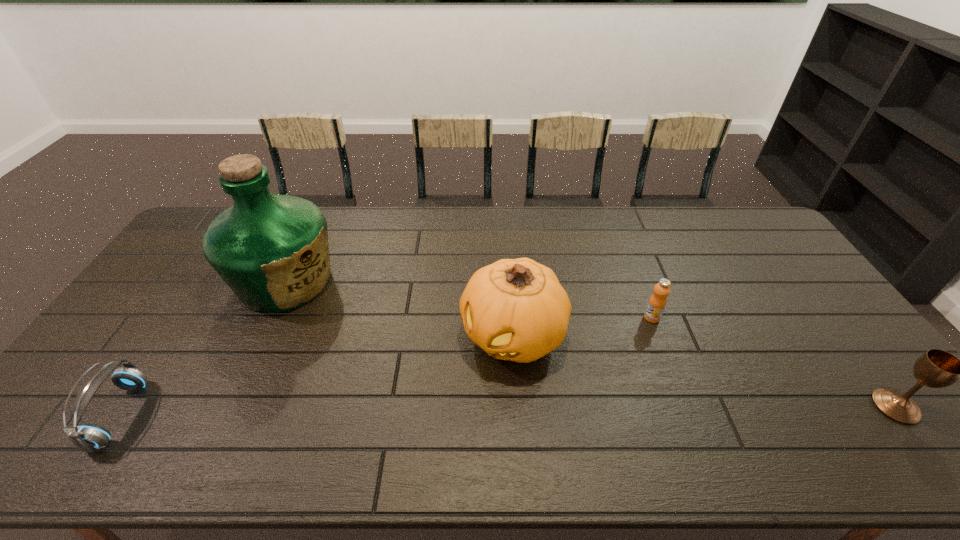
Find the location of a particular element. headset is located at coordinates (87, 437).

Locate an element on the screen. the rightmost object is located at coordinates pyautogui.click(x=936, y=368).

You are a GUI agent. You are given a task and a screenshot of the screen. Output one action in this format:
    pyautogui.click(x=<x>, y=<y>)
    Task: Click on the third tallest object
    The width and height of the screenshot is (960, 540).
    Given the screenshot: What is the action you would take?
    pyautogui.click(x=936, y=368)

At what (x,y) coordinates should I click in order to perform the action: click on the fourth object from left to right. Please return your answer as a coordinate pair (x, y). Image resolution: width=960 pixels, height=540 pixels. Looking at the image, I should click on [657, 302].

This screenshot has height=540, width=960. I want to click on the tallest object, so click(x=272, y=251).

What are the coordinates of `the second object from left to right` in the screenshot? It's located at (272, 251).

Image resolution: width=960 pixels, height=540 pixels. Find the location of `pumpkin`. pumpkin is located at coordinates click(515, 309).

Locate an element on the screen. the second tallest object is located at coordinates (515, 309).

Where is `free space located on the ear cups of the leftmost object`? free space located on the ear cups of the leftmost object is located at coordinates (72, 415).

I want to click on vacant region located 0.170m on the back of the rightmost object, so click(x=842, y=336).